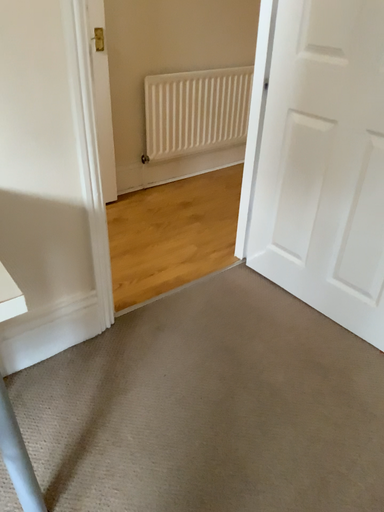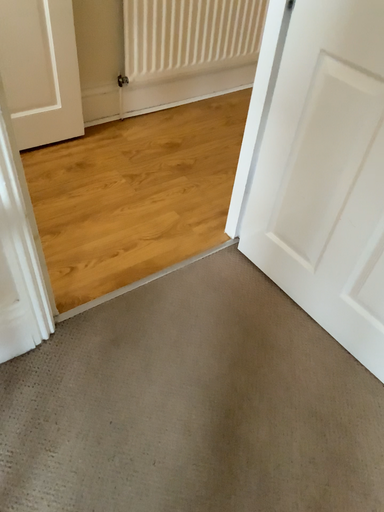
Question: How did the camera likely rotate when shooting the video?

Choices:
 (A) rotated upward
 (B) rotated downward

Answer: (B)